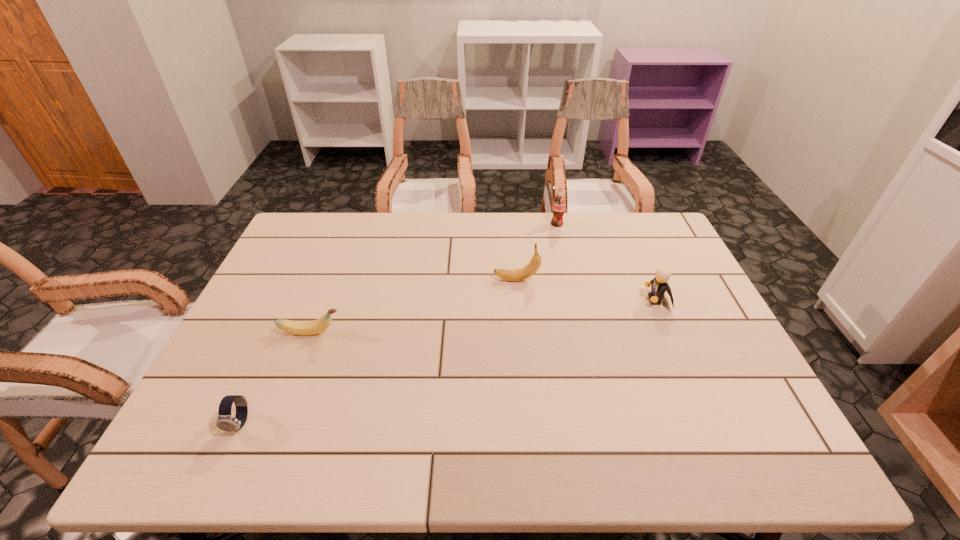
Find the location of a particular element. The height and width of the screenshot is (540, 960). empty location between the second farthest object and the left banana is located at coordinates (414, 306).

The height and width of the screenshot is (540, 960). I want to click on vacant area that lies between the taller banana and the shorter banana, so click(414, 306).

Where is `free space between the farther banana and the left banana`? free space between the farther banana and the left banana is located at coordinates (414, 306).

Where is `free space between the right banana and the watch`? The width and height of the screenshot is (960, 540). free space between the right banana and the watch is located at coordinates (378, 352).

Where is `free space between the watch and the second nearest object`? The width and height of the screenshot is (960, 540). free space between the watch and the second nearest object is located at coordinates (276, 377).

Find the location of a particular element. free space between the farthest object and the rightmost object is located at coordinates (607, 262).

Identify the location of free area in between the third shortest object and the left banana. The height and width of the screenshot is (540, 960). (484, 316).

Find the location of a particular element. This screenshot has height=540, width=960. object that is the second closest one to the rightmost object is located at coordinates [559, 204].

Identify which object is located as the fourth nearest to the watch. Please provide its 2D coordinates. Your answer should be formatted as a tuple, i.e. [(x, y)], where the tuple contains the x and y coordinates of a point satisfying the conditions above.

[(559, 204)]

You are a GUI agent. You are given a task and a screenshot of the screen. Output one action in this format:
    pyautogui.click(x=<x>, y=<y>)
    Task: Click on the free space that satisfies the following two spatial constraints: 1. on the front-facing side of the Lego; 2. on the face of the nearest object
    This screenshot has height=540, width=960.
    Given the screenshot: What is the action you would take?
    710,423